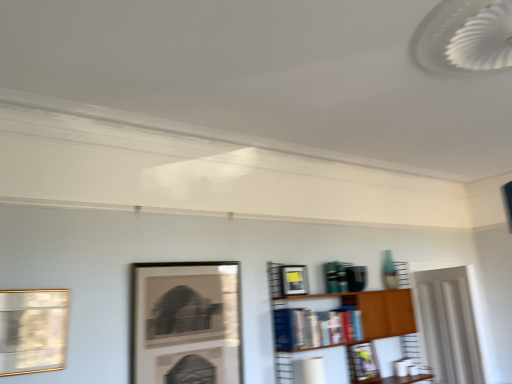
Image resolution: width=512 pixels, height=384 pixels. Describe the element at coordinates (339, 326) in the screenshot. I see `wooden bookshelf at center-right` at that location.

At what (x,y) coordinates should I click in order to perform the action: click on wooden bookshelf at center-right. Please return your answer as a coordinate pair (x, y). Looking at the image, I should click on (339, 326).

The image size is (512, 384). What are the coordinates of `matte black picture frame at upper center, the second picture frame positioned from the right` in the screenshot? It's located at (294, 280).

Is matte black picture frame at upper center, which appears as the fourth picture frame when viewed from the front, oriented towards hardcover books at center?

No, matte black picture frame at upper center, which appears as the fourth picture frame when viewed from the front, is not aimed at hardcover books at center.

Which is farther from the camera, (374, 374) or (319, 331)?

The point (374, 374) is more distant.

Can you confirm if matte black picture frame at upper center, which appears as the fourth picture frame when viewed from the front, is taller than hardcover books at center?

Correct, matte black picture frame at upper center, which appears as the fourth picture frame when viewed from the front, is much taller as hardcover books at center.

Relative to hardcover books at center, is matte black picture frame at upper center, which is the fourth picture frame in left-to-right order, in front or behind?

In the image, matte black picture frame at upper center, which is the fourth picture frame in left-to-right order, appears behind hardcover books at center.

Who is shorter, gold-framed picture at left, positioned as the first picture frame in left-to-right order, or matte black picture frame at upper center, placed as the third picture frame when sorted from front to back?

matte black picture frame at upper center, placed as the third picture frame when sorted from front to back.

From a real-world perspective, is gold-framed picture at left, positioned as the first picture frame in left-to-right order, located higher than matte black picture frame at upper center, which is counted as the third picture frame, starting from the left?

No, from a real-world perspective, gold-framed picture at left, positioned as the first picture frame in left-to-right order, is not above matte black picture frame at upper center, which is counted as the third picture frame, starting from the left.

Which is farther from the camera, [44,355] or [288,294]?

The point [288,294] is more distant.

From a real-world perspective, relative to matte black picture frame at upper center, which appears as the fourth picture frame when viewed from the front, is hardcover books at center vertically above or below?

hardcover books at center is above matte black picture frame at upper center, which appears as the fourth picture frame when viewed from the front.

In order to click on the 2nd picture frame behind the hardcover books at center, counting from the anchor's position in this screenshot , I will do `click(362, 364)`.

Can you confirm if hardcover books at center is smaller than matte black picture frame at upper center, which is the 1th picture frame in right-to-left order?

Incorrect, hardcover books at center is not smaller in size than matte black picture frame at upper center, which is the 1th picture frame in right-to-left order.

Which of these two, wooden bookshelf at center-right or matte black picture frame at upper center, which is counted as the second picture frame, starting from the back, is wider?

With larger width is wooden bookshelf at center-right.

Is the depth of wooden bookshelf at center-right less than that of matte black picture frame at upper center, placed as the third picture frame when sorted from front to back?

Yes, wooden bookshelf at center-right is closer to the viewer.

What's the angular difference between wooden bookshelf at center-right and matte black picture frame at upper center, which is counted as the third picture frame, starting from the left,'s facing directions?

The facing directions of wooden bookshelf at center-right and matte black picture frame at upper center, which is counted as the third picture frame, starting from the left, are 1.15 degrees apart.

Is wooden bookshelf at center-right oriented away from matte black picture frame at upper center, which is counted as the second picture frame, starting from the back?

wooden bookshelf at center-right does not have its back to matte black picture frame at upper center, which is counted as the second picture frame, starting from the back.

In the scene shown: From the image's perspective, is matte black picture frame at upper center, placed as the first picture frame when sorted from back to front, on wooden bookshelf at center-right?

No, from the image's perspective, matte black picture frame at upper center, placed as the first picture frame when sorted from back to front, is not on top of wooden bookshelf at center-right.

From the picture: Could wooden bookshelf at center-right be considered to be inside matte black picture frame at upper center, which is the 1th picture frame in right-to-left order?

No, matte black picture frame at upper center, which is the 1th picture frame in right-to-left order, does not contain wooden bookshelf at center-right.

What's the angular difference between matte black picture frame at upper center, placed as the first picture frame when sorted from back to front, and wooden bookshelf at center-right's facing directions?

The angle between the facing direction of matte black picture frame at upper center, placed as the first picture frame when sorted from back to front, and the facing direction of wooden bookshelf at center-right is 2.75 degrees.

Based on the photo, can you confirm if matte black picture frame at upper center, which appears as the fourth picture frame when viewed from the front, is smaller than wooden bookshelf at center-right?

Indeed, matte black picture frame at upper center, which appears as the fourth picture frame when viewed from the front, has a smaller size compared to wooden bookshelf at center-right.

Does hardcover books at center appear on the right side of gold-framed picture at left, which is the 4th picture frame from right to left?

Indeed, hardcover books at center is positioned on the right side of gold-framed picture at left, which is the 4th picture frame from right to left.

From a real-world perspective, is hardcover books at center positioned above or below gold-framed picture at left, which is the 4th picture frame from right to left?

From a real-world perspective, hardcover books at center is physically below gold-framed picture at left, which is the 4th picture frame from right to left.

Is hardcover books at center completely or partially outside of gold-framed picture at left, which ranks as the fourth picture frame in back-to-front order?

Absolutely, hardcover books at center is external to gold-framed picture at left, which ranks as the fourth picture frame in back-to-front order.

Which point is more distant from viewer, (300, 331) or (62, 297)?

The point (300, 331) is more distant.

How different are the orientations of wooden bookshelf at center-right and gold-framed picture at left, the first picture frame viewed from the front, in degrees?

The angle between the facing direction of wooden bookshelf at center-right and the facing direction of gold-framed picture at left, the first picture frame viewed from the front, is 0.977 degrees.

Is wooden bookshelf at center-right in front of or behind gold-framed picture at left, which ranks as the fourth picture frame in back-to-front order, in the image?

wooden bookshelf at center-right is behind gold-framed picture at left, which ranks as the fourth picture frame in back-to-front order.

Is wooden bookshelf at center-right not near gold-framed picture at left, which ranks as the fourth picture frame in back-to-front order?

Yes, wooden bookshelf at center-right and gold-framed picture at left, which ranks as the fourth picture frame in back-to-front order, are quite far apart.

From the wooden bookshelf at center-right, count the 3rd picture frame to the left and point to it. Please provide its 2D coordinates.

[(33, 330)]

Locate an element on the screen. This screenshot has width=512, height=384. picture frame lying below the hardcover books at center (from the image's perspective) is located at coordinates (362, 364).

At what (x,y) coordinates should I click in order to perform the action: click on the 2nd picture frame in front of the matte black picture frame at upper center, which is counted as the second picture frame, starting from the back. Please return your answer as a coordinate pair (x, y). Image resolution: width=512 pixels, height=384 pixels. Looking at the image, I should click on 33,330.

Which object lies nearer to the anchor point gold-framed picture at left, which ranks as the fourth picture frame in back-to-front order, hardcover books at center or matte black picture frame at upper center, which is counted as the second picture frame, starting from the back?

hardcover books at center is positioned closer to the anchor gold-framed picture at left, which ranks as the fourth picture frame in back-to-front order.

From the image, which object appears to be farther from matte black picture frame at upper center, which is counted as the second picture frame, starting from the back, hardcover books at center or gold-framed picture at left, which ranks as the fourth picture frame in back-to-front order?

gold-framed picture at left, which ranks as the fourth picture frame in back-to-front order, is further to matte black picture frame at upper center, which is counted as the second picture frame, starting from the back.

From the image, which object appears to be nearer to matte black picture frame at center, which appears as the third picture frame when viewed from the back, wooden bookshelf at center-right or matte black picture frame at upper center, placed as the first picture frame when sorted from back to front?

wooden bookshelf at center-right lies closer to matte black picture frame at center, which appears as the third picture frame when viewed from the back, than the other object.

Based on their spatial positions, is matte black picture frame at upper center, which appears as the fourth picture frame when viewed from the front, or matte black picture frame at upper center, the second picture frame positioned from the right, closer to matte black picture frame at center, which appears as the second picture frame when viewed from the left?

matte black picture frame at upper center, the second picture frame positioned from the right.

Estimate the real-world distances between objects in this image. Which object is further from gold-framed picture at left, positioned as the first picture frame in left-to-right order, wooden bookshelf at center-right or matte black picture frame at upper center, the second picture frame positioned from the right?

wooden bookshelf at center-right lies further to gold-framed picture at left, positioned as the first picture frame in left-to-right order, than the other object.

Based on their spatial positions, is matte black picture frame at center, which appears as the second picture frame when viewed from the left, or hardcover books at center further from matte black picture frame at upper center, which is counted as the second picture frame, starting from the back?

Based on the image, matte black picture frame at center, which appears as the second picture frame when viewed from the left, appears to be further to matte black picture frame at upper center, which is counted as the second picture frame, starting from the back.

When comparing their distances from matte black picture frame at upper center, placed as the third picture frame when sorted from front to back, does wooden bookshelf at center-right or matte black picture frame at upper center, which is the 1th picture frame in right-to-left order, seem closer?

wooden bookshelf at center-right lies closer to matte black picture frame at upper center, placed as the third picture frame when sorted from front to back, than the other object.

From the picture: Considering their positions, is matte black picture frame at upper center, which is counted as the third picture frame, starting from the left, positioned further to wooden bookshelf at center-right than hardcover books at center?

Among the two, matte black picture frame at upper center, which is counted as the third picture frame, starting from the left, is located further to wooden bookshelf at center-right.

Image resolution: width=512 pixels, height=384 pixels. In order to click on picture frame between matte black picture frame at center, which appears as the second picture frame when viewed from the left, and wooden bookshelf at center-right in this screenshot , I will do `click(294, 280)`.

I want to click on picture frame between matte black picture frame at center, the third picture frame positioned from the right, and hardcover books at center from left to right, so click(294, 280).

The image size is (512, 384). In order to click on book between matte black picture frame at center, which appears as the third picture frame when viewed from the back, and wooden bookshelf at center-right, in the horizontal direction in this screenshot , I will do `click(315, 328)`.

The width and height of the screenshot is (512, 384). In order to click on book located between matte black picture frame at center, which appears as the third picture frame when viewed from the back, and matte black picture frame at upper center, placed as the first picture frame when sorted from back to front, in the left-right direction in this screenshot , I will do `click(315, 328)`.